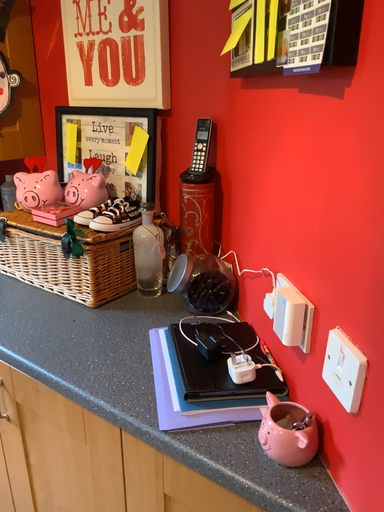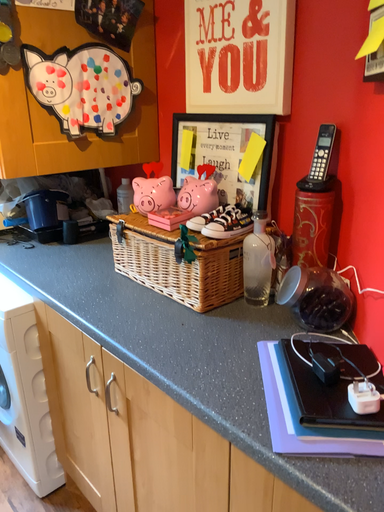
Question: Which way did the camera rotate in the video?

Choices:
 (A) rotated right
 (B) rotated left

Answer: (B)